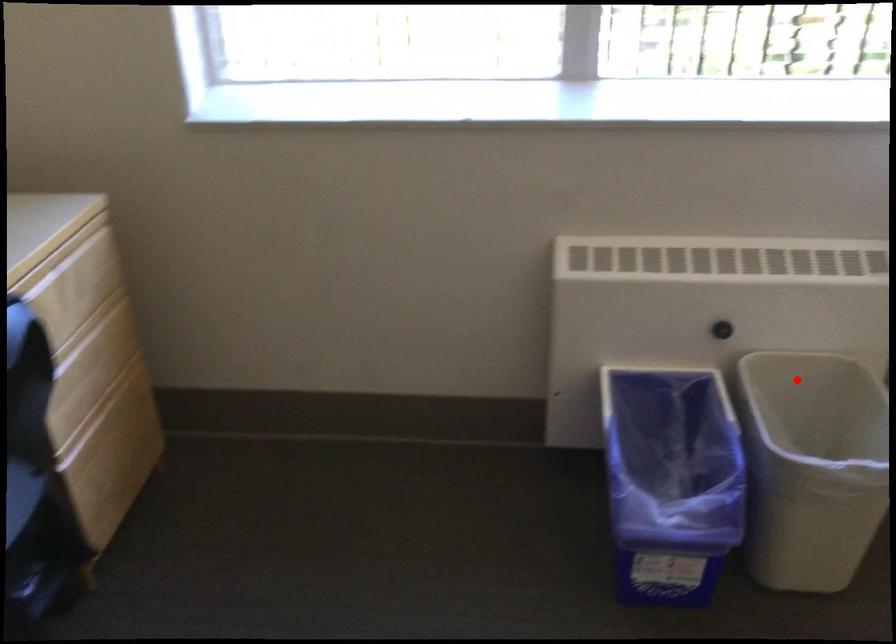
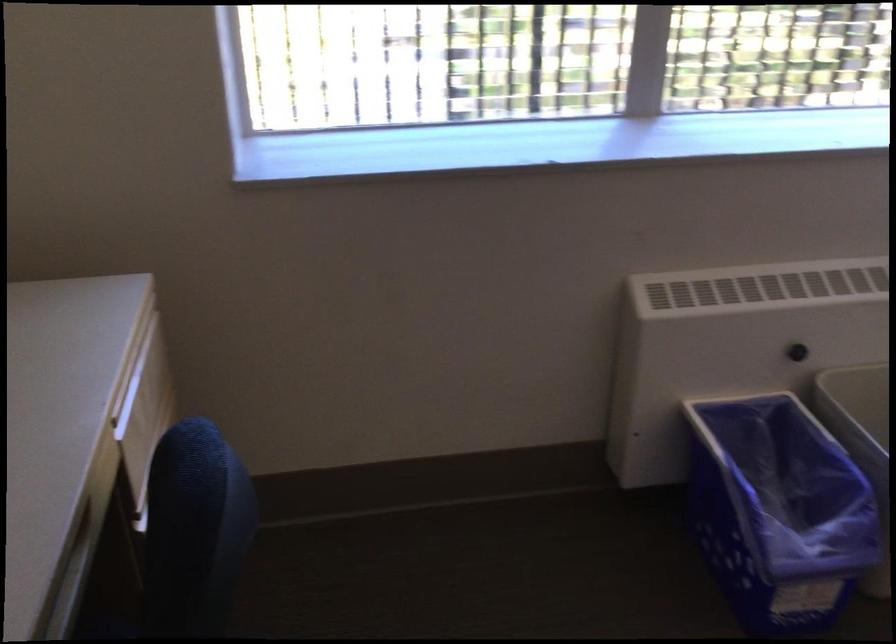
Locate, in the second image, the point that corresponds to the highlighted location in the first image.

(860, 391)